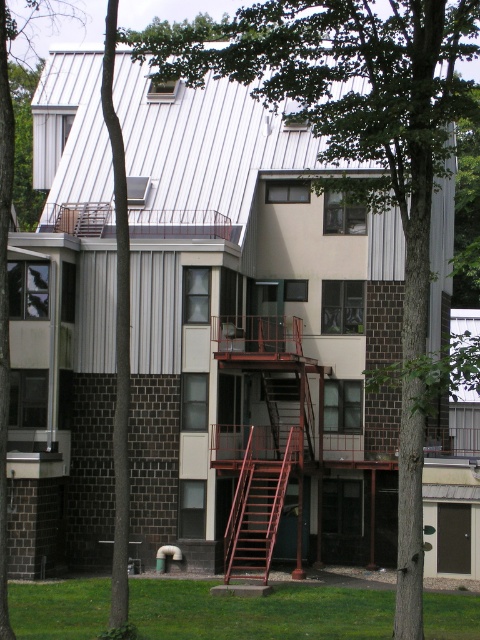
Consider the image. You are a delivery person trying to reach the second floor apartment located at the center of the building. The building has a rusty metal fire escape at center. Can you use the fire escape to reach the apartment?

The rusty metal fire escape at center is positioned at point [264,440], which corresponds to the second floor level. Therefore, yes, you can use the fire escape to reach the apartment.

You are standing at the base of the building and looking up. There are two points marked on the building wall. The first point is at coordinates point (248, 554) and the second point is at point (269, 408). Which of these points is closer to you?

Point (248, 554) is in front of point (269, 408), so the first point is closer to you.

You are standing in front of the residential building and notice both the rusty metal fire escape at center and the green leafy tree at center. Which object is positioned to the right when viewed from your perspective?

The rusty metal fire escape at center is to the right of the green leafy tree at center, so it is positioned to the right when viewed from your perspective.